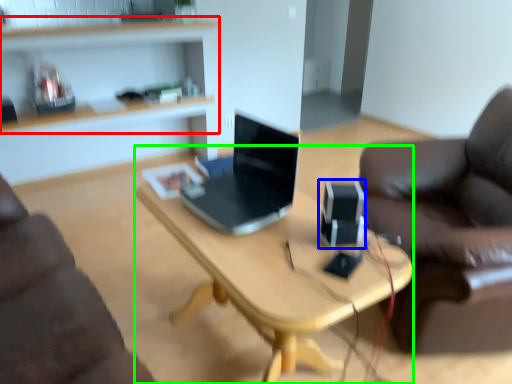
Question: Which object is the farthest from shelf (highlighted by a red box)? Choose among these: speaker (highlighted by a blue box) or desk (highlighted by a green box).

Choices:
 (A) speaker
 (B) desk

Answer: (A)